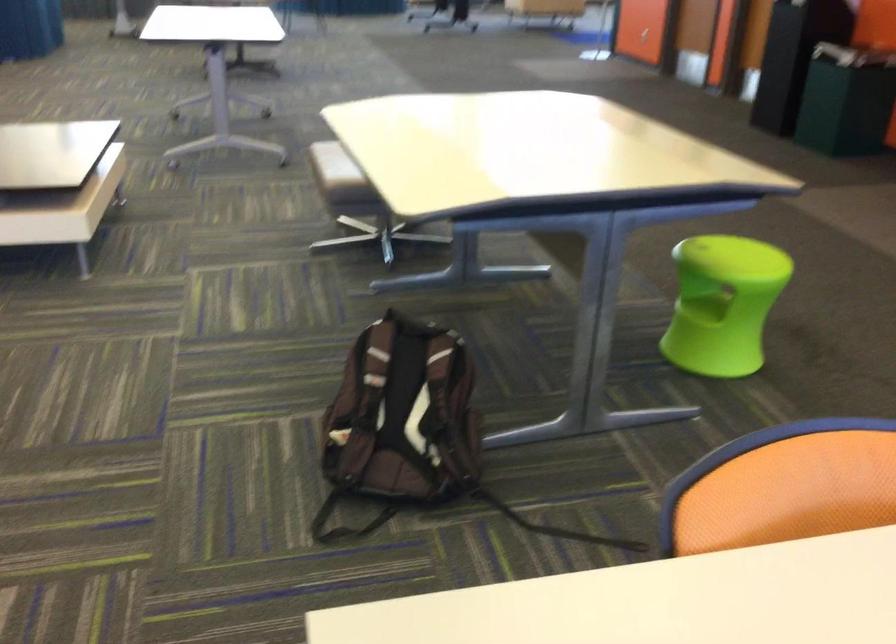
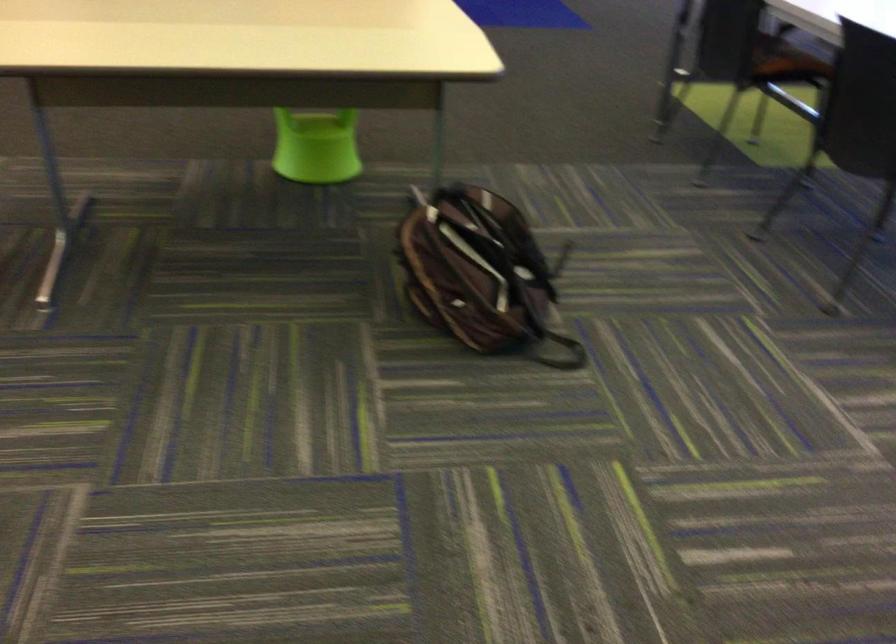
The point at (366,401) is marked in the first image. Where is the corresponding point in the second image?

(479, 272)